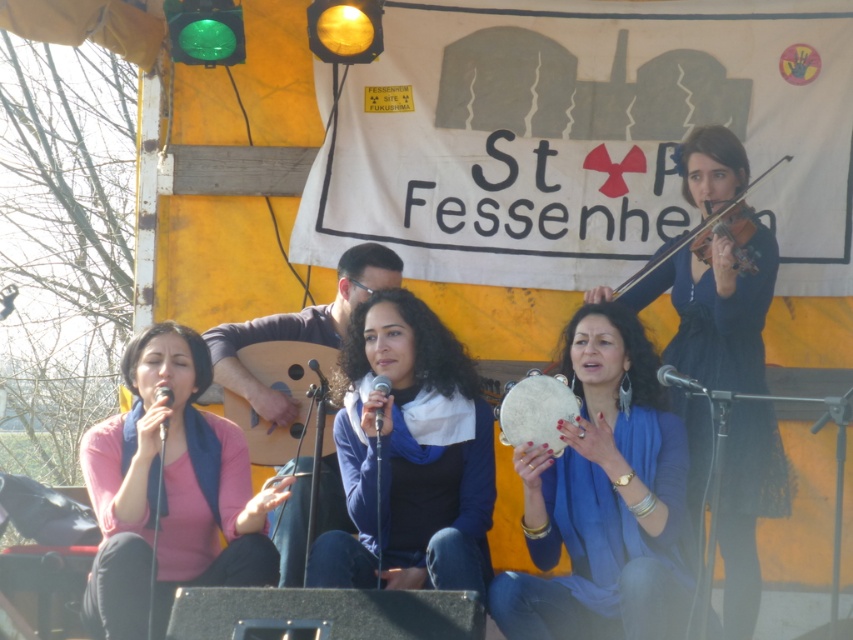
Can you confirm if wooden violin at upper right is positioned to the left of metallic silver microphone at lower right?

Incorrect, wooden violin at upper right is not on the left side of metallic silver microphone at lower right.

Does wooden violin at upper right lie in front of metallic silver microphone at lower right?

No, it is not.

Does point (740, 237) come in front of point (697, 388)?

No.

Where is `wooden violin at upper right`? The height and width of the screenshot is (640, 853). wooden violin at upper right is located at coordinates (701, 232).

Between blue fabric scarf at center and metallic silver microphone at center, which one is positioned higher?

metallic silver microphone at center is higher up.

Is point (428, 493) positioned after point (381, 388)?

Yes, point (428, 493) is behind point (381, 388).

The height and width of the screenshot is (640, 853). Identify the location of blue fabric scarf at center. (410, 456).

Is blue fabric tambourine at center bigger than pink matte sweater at left?

Correct, blue fabric tambourine at center is larger in size than pink matte sweater at left.

Can you confirm if blue fabric tambourine at center is positioned to the right of pink matte sweater at left?

Correct, you'll find blue fabric tambourine at center to the right of pink matte sweater at left.

Who is more distant from viewer, (x=543, y=552) or (x=216, y=465)?

Point (x=216, y=465)

You are a GUI agent. You are given a task and a screenshot of the screen. Output one action in this format:
    pyautogui.click(x=<x>, y=<y>)
    Task: Click on the blue fabric tambourine at center
    The image size is (853, 640).
    Given the screenshot: What is the action you would take?
    pyautogui.click(x=602, y=499)